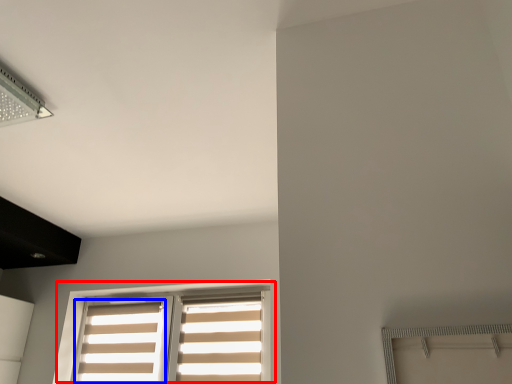
Question: Among these objects, which one is nearest to the camera, window (highlighted by a red box) or curtain (highlighted by a blue box)?

Choices:
 (A) window
 (B) curtain

Answer: (A)